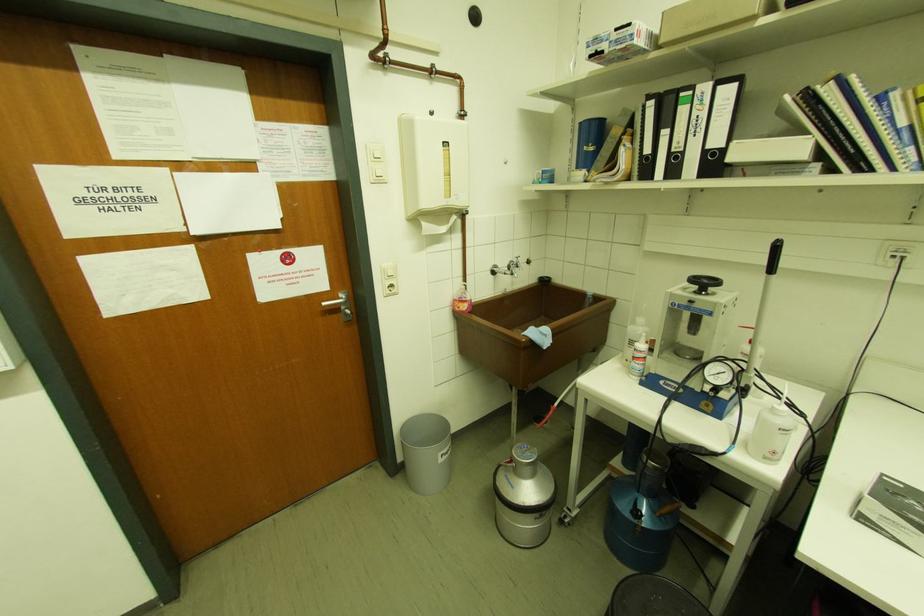
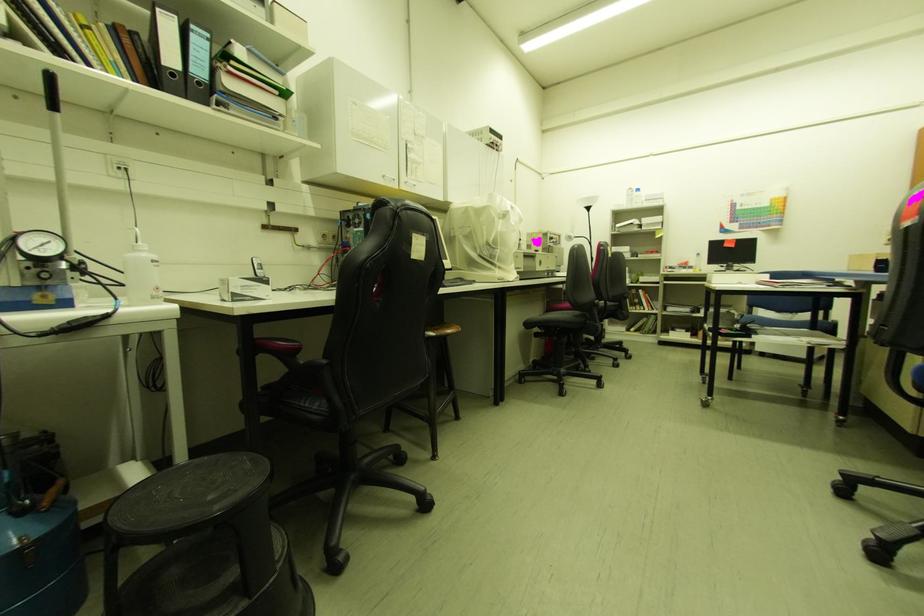
Question: The camera is either moving clockwise (left) or counter-clockwise (right) around the object. The first image is from the beginning of the video and the second image is from the end. Is the camera moving left or right when shooting the video?

Choices:
 (A) Left
 (B) Right

Answer: (A)